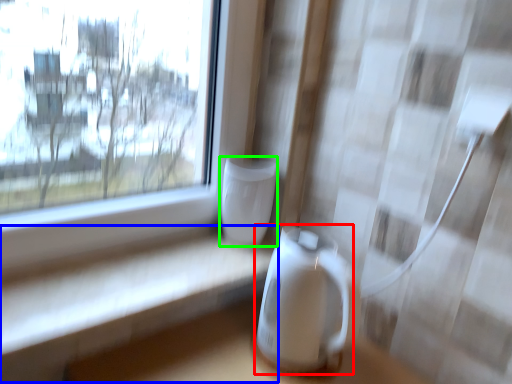
Question: Which object is positioned closest to appliance (highlighted by a red box)? Select from table (highlighted by a blue box) and appliance (highlighted by a green box).

Choices:
 (A) table
 (B) appliance

Answer: (B)